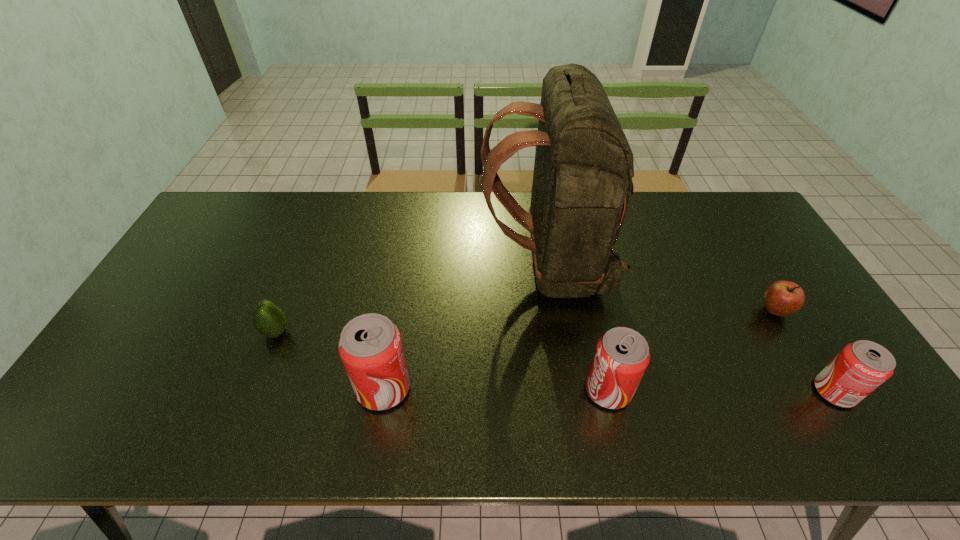
Identify the location of free point that keeps the soda cans evenly spaced on the left. Image resolution: width=960 pixels, height=540 pixels. (160, 386).